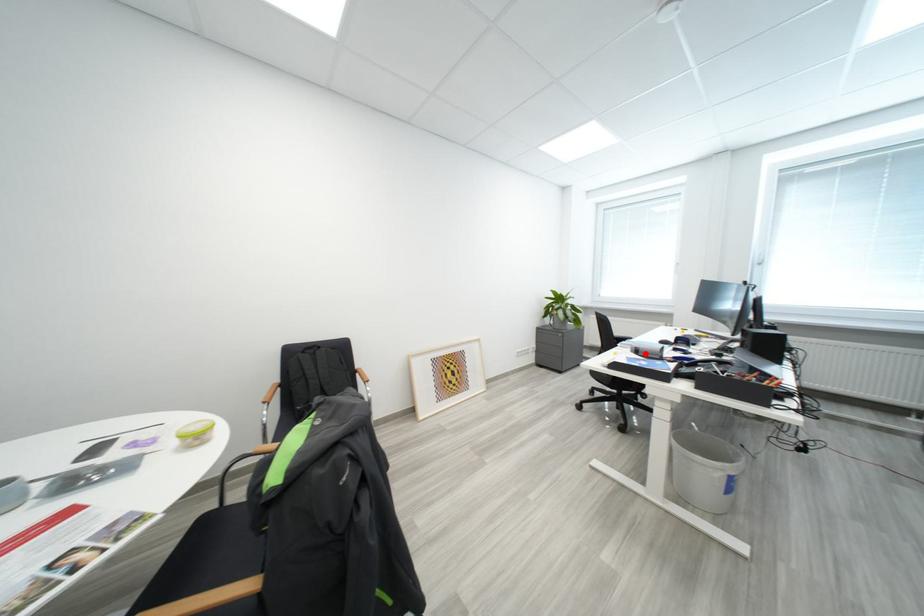
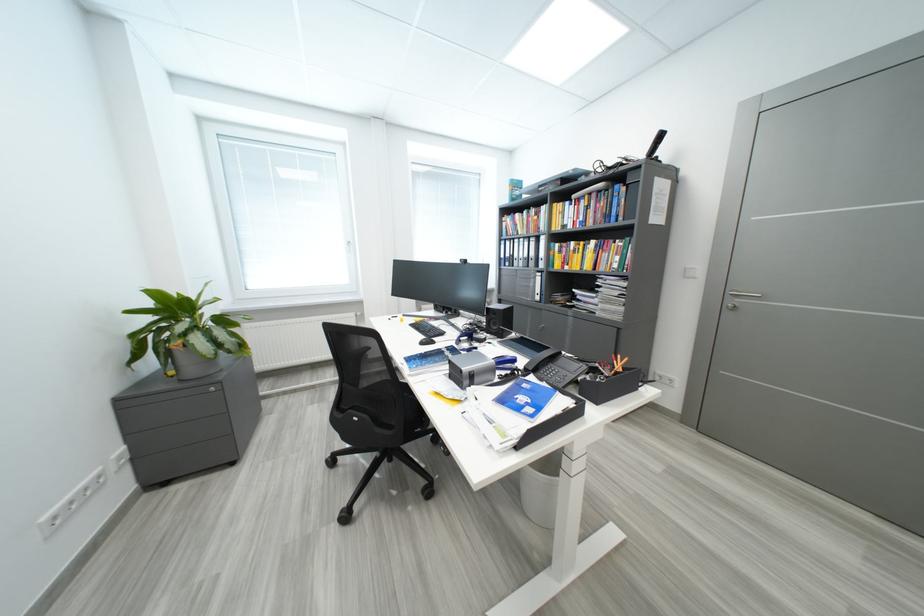
Question: A red point is marked in image1. In image2, is the corresponding 3D point closer to the camera or farther? Reply with the corresponding letter.

Choices:
 (A) The corresponding 3D point is closer.
 (B) The corresponding 3D point is farther.

Answer: (B)